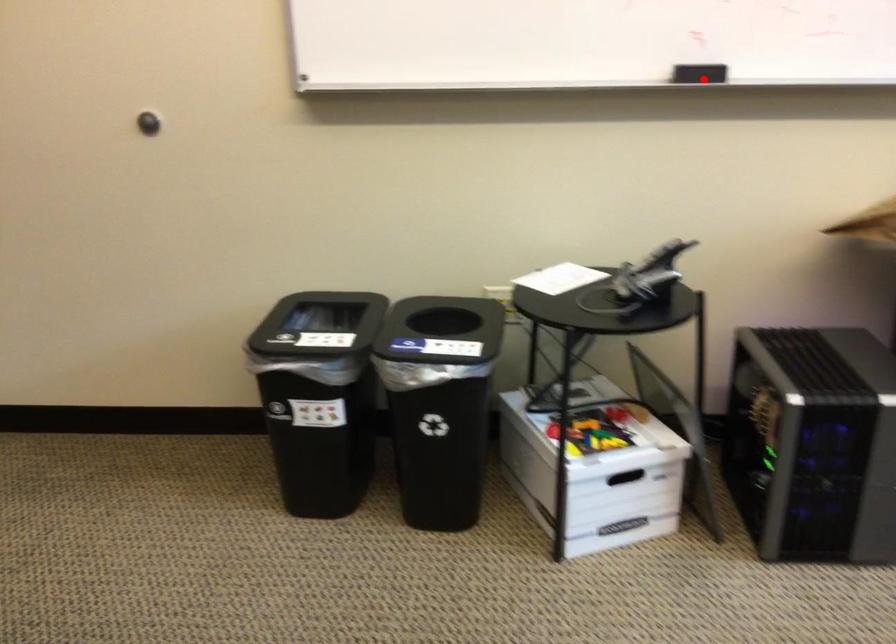
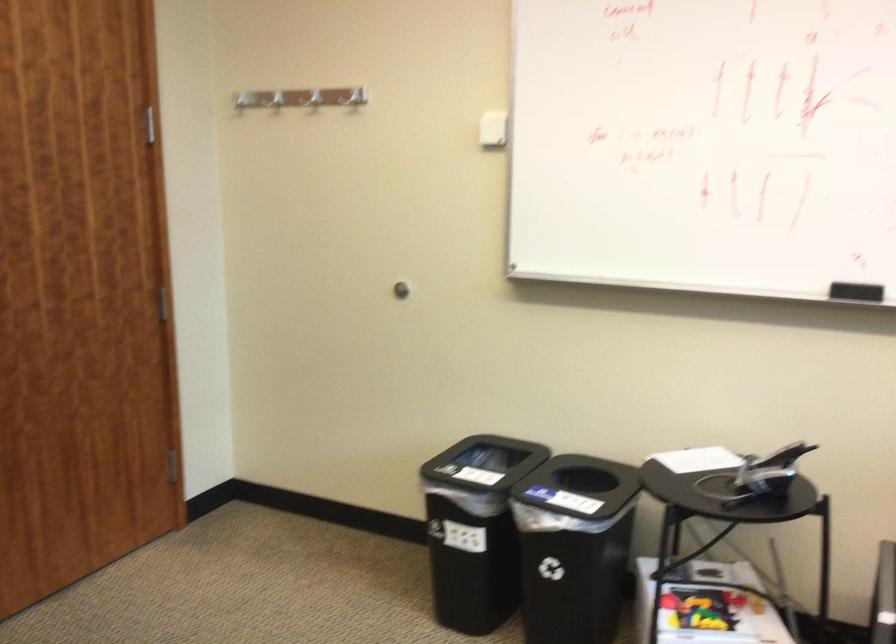
The point at the highlighted location is marked in the first image. Where is the corresponding point in the second image?

(856, 292)